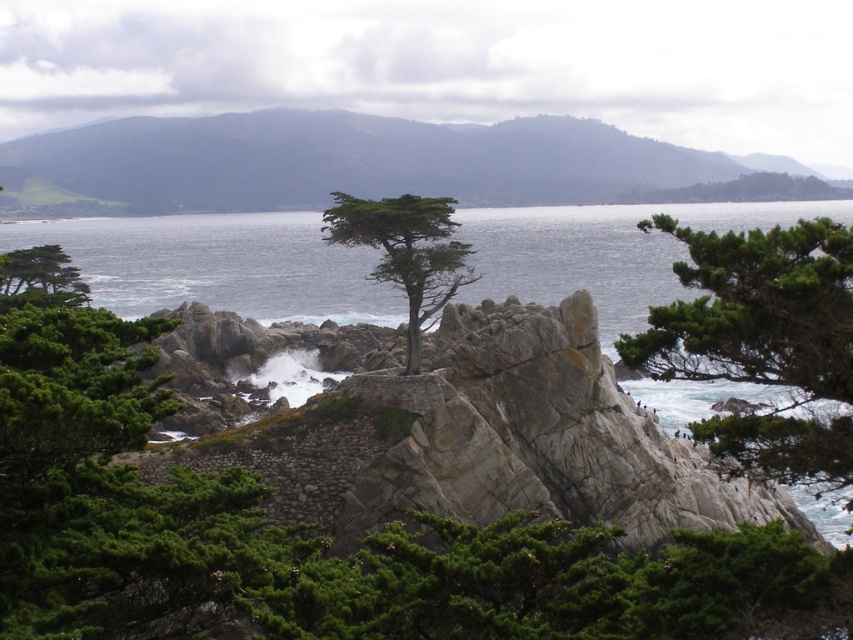
Does green textured pine tree at right have a greater height compared to green textured tree at center?

Yes, green textured pine tree at right is taller than green textured tree at center.

Which is behind, point (840, 320) or point (405, 253)?

Positioned behind is point (405, 253).

The width and height of the screenshot is (853, 640). In order to click on green textured pine tree at right in this screenshot , I will do `click(762, 340)`.

Which is below, green textured tree at center or green matte tree at left?

green matte tree at left

I want to click on green textured tree at center, so click(x=405, y=252).

Where is `green textured tree at center`? The width and height of the screenshot is (853, 640). green textured tree at center is located at coordinates (405, 252).

Does green textured pine tree at right come in front of green matte tree at left?

Yes, it is in front of green matte tree at left.

Does point (654, 344) come closer to viewer compared to point (6, 304)?

Yes, it is.

Locate an element on the screen. green textured pine tree at right is located at coordinates (762, 340).